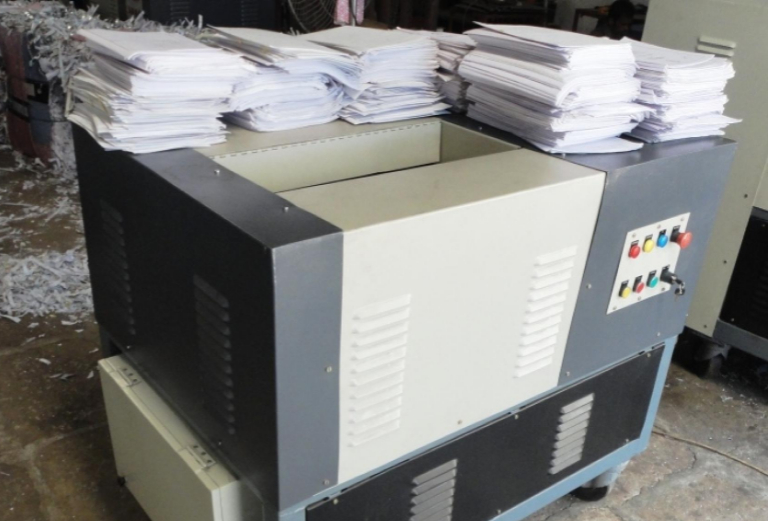
Locate an element on the screen. Image resolution: width=768 pixels, height=521 pixels. stacks of paper is located at coordinates (167, 82), (265, 85), (369, 73), (454, 60), (620, 82), (697, 92).